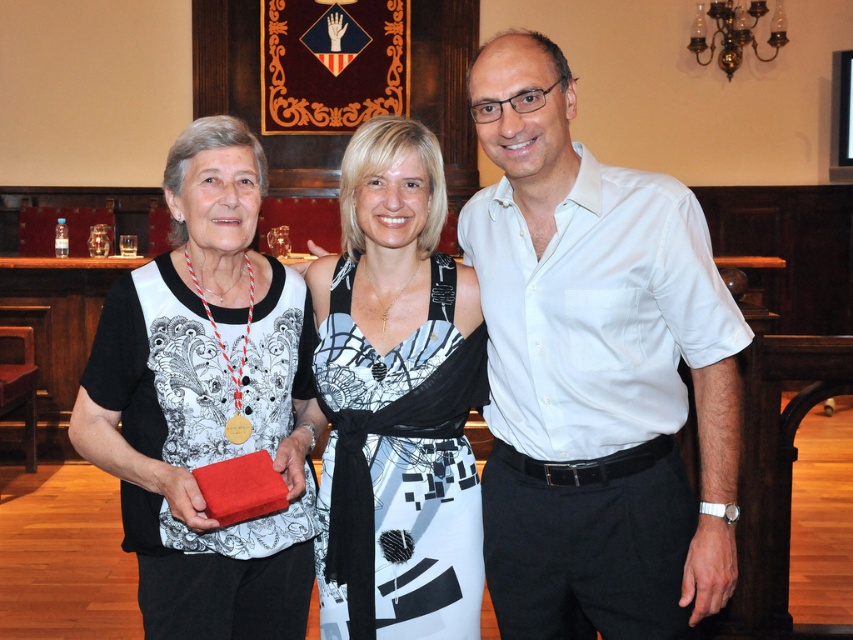
Which is more to the left, matte black dress at center or printed fabric dress at center?

From the viewer's perspective, matte black dress at center appears more on the left side.

Locate an element on the screen. This screenshot has height=640, width=853. matte black dress at center is located at coordinates (207, 403).

Is point (206, 618) positioned in front of point (361, 212)?

Yes.

The width and height of the screenshot is (853, 640). Identify the location of matte black dress at center. (207, 403).

Does point (608, 339) lie in front of point (434, 237)?

That is True.

Between white cotton shirt at center and printed fabric dress at center, which one is positioned higher?

white cotton shirt at center is higher up.

Between point (494, 436) and point (393, 472), which one is positioned in front?

Point (393, 472) is in front.

I want to click on white cotton shirt at center, so click(x=595, y=372).

How far apart are white cotton shirt at center and matte black dress at center?

white cotton shirt at center is 28.25 inches from matte black dress at center.

Is point (521, 269) closer to camera compared to point (219, 326)?

No, it is not.

Which is in front, point (641, 316) or point (286, 589)?

Point (641, 316) is in front.

This screenshot has width=853, height=640. I want to click on white cotton shirt at center, so click(595, 372).